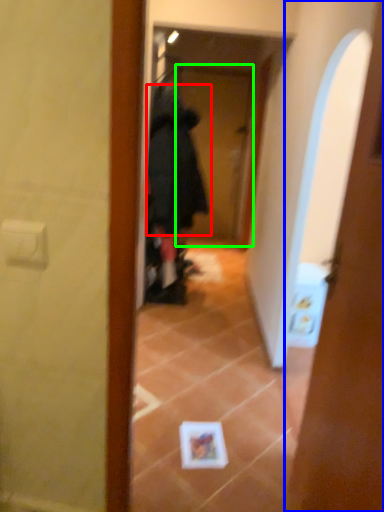
Question: Which object is the closest to the bathrobe (highlighted by a red box)? Choose among these: door (highlighted by a blue box) or screen door (highlighted by a green box).

Choices:
 (A) door
 (B) screen door

Answer: (A)